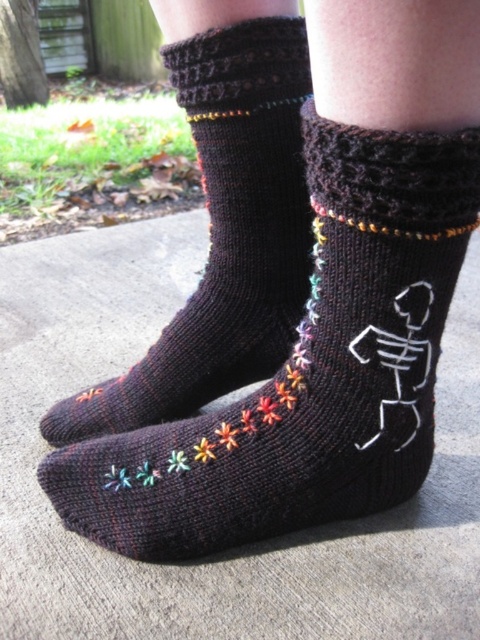
Question: Observing the image, what is the correct spatial positioning of black knitted socks at center in reference to black knitted socks at lower left?

Choices:
 (A) above
 (B) below

Answer: (B)

Question: Which point appears closest to the camera in this image?

Choices:
 (A) (282, 173)
 (B) (81, 432)

Answer: (A)

Question: Is black knitted socks at center positioned behind black knitted socks at lower left?

Choices:
 (A) yes
 (B) no

Answer: (B)

Question: Is black knitted socks at center smaller than black knitted socks at lower left?

Choices:
 (A) yes
 (B) no

Answer: (B)

Question: Which of the following is the farthest from the observer?

Choices:
 (A) (422, 252)
 (B) (112, 422)

Answer: (B)